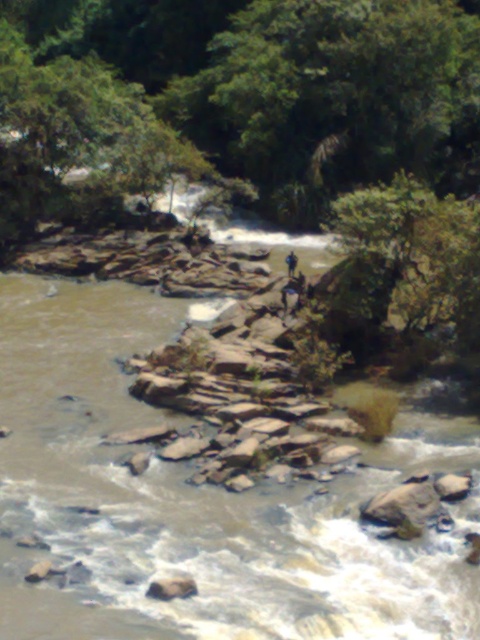
Question: Observing the image, what is the correct spatial positioning of brown rough rock at lower left in reference to dark blue jeans at center?

Choices:
 (A) left
 (B) right

Answer: (A)

Question: Which of the following is the closest to the observer?

Choices:
 (A) brown rough rock at lower left
 (B) dark blue jeans at center

Answer: (A)

Question: Does brown rough rock at lower left appear over dark blue jeans at center?

Choices:
 (A) yes
 (B) no

Answer: (B)

Question: Which of the following is the farthest from the observer?

Choices:
 (A) (172, 579)
 (B) (288, 256)

Answer: (B)

Question: Does brown rough rock at lower left come behind dark blue jeans at center?

Choices:
 (A) yes
 (B) no

Answer: (B)